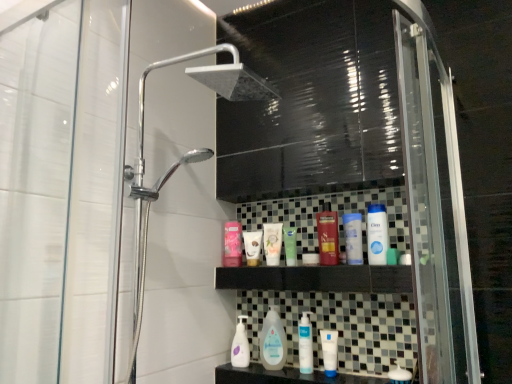
Question: Is white glossy mouthwash at lower center, arranged as the second mouthwash when ordered from the bottom, next to matte white tube at center, which is the 2th toiletry in left-to-right order?

Choices:
 (A) no
 (B) yes

Answer: (A)

Question: Is white glossy mouthwash at lower center, which is the 2th mouthwash in top-to-bottom order, wider than matte white tube at center, which is the 2th toiletry in left-to-right order?

Choices:
 (A) no
 (B) yes

Answer: (A)

Question: Does white glossy mouthwash at lower center, arranged as the second mouthwash when ordered from the bottom, have a greater height compared to matte white tube at center, which is the 2th toiletry in left-to-right order?

Choices:
 (A) no
 (B) yes

Answer: (B)

Question: Considering the relative positions of white glossy mouthwash at lower center, acting as the first mouthwash starting from the left, and matte white tube at center, which is the 2th toiletry in left-to-right order, in the image provided, is white glossy mouthwash at lower center, acting as the first mouthwash starting from the left, to the left of matte white tube at center, which is the 2th toiletry in left-to-right order, from the viewer's perspective?

Choices:
 (A) yes
 (B) no

Answer: (B)

Question: From the image's perspective, is white glossy mouthwash at lower center, arranged as the second mouthwash when ordered from the bottom, on matte white tube at center, arranged as the 7th toiletry when viewed from the right?

Choices:
 (A) no
 (B) yes

Answer: (A)

Question: Can you confirm if white glossy mouthwash at lower center, arranged as the second mouthwash when ordered from the bottom, is positioned to the right of matte white tube at center, arranged as the 7th toiletry when viewed from the right?

Choices:
 (A) no
 (B) yes

Answer: (B)

Question: Is white matte container at center, placed as the fifth toiletry when sorted from left to right, completely or partially outside of white glossy lotion at center, which appears as the 2th toiletry when viewed from the right?

Choices:
 (A) no
 (B) yes

Answer: (B)

Question: Can you confirm if white matte container at center, the fourth toiletry positioned from the right, is positioned to the right of white glossy lotion at center, which appears as the 2th toiletry when viewed from the right?

Choices:
 (A) yes
 (B) no

Answer: (B)

Question: From the image's perspective, is white matte container at center, placed as the fifth toiletry when sorted from left to right, under white glossy lotion at center, which appears as the 2th toiletry when viewed from the right?

Choices:
 (A) yes
 (B) no

Answer: (A)

Question: Considering the relative positions of white matte container at center, placed as the fifth toiletry when sorted from left to right, and white glossy lotion at center, the 7th toiletry in the left-to-right sequence, in the image provided, is white matte container at center, placed as the fifth toiletry when sorted from left to right, to the left of white glossy lotion at center, the 7th toiletry in the left-to-right sequence, from the viewer's perspective?

Choices:
 (A) yes
 (B) no

Answer: (A)

Question: From a real-world perspective, is white matte container at center, placed as the fifth toiletry when sorted from left to right, positioned under white glossy lotion at center, the 7th toiletry in the left-to-right sequence, based on gravity?

Choices:
 (A) no
 (B) yes

Answer: (B)

Question: Is white matte container at center, placed as the fifth toiletry when sorted from left to right, thinner than white glossy lotion at center, which appears as the 2th toiletry when viewed from the right?

Choices:
 (A) no
 (B) yes

Answer: (B)

Question: From the image's perspective, is white glossy soap at lower center, the first toiletry when ordered from right to left, located beneath matte white tube at center, which is the 2th toiletry in left-to-right order?

Choices:
 (A) no
 (B) yes

Answer: (B)